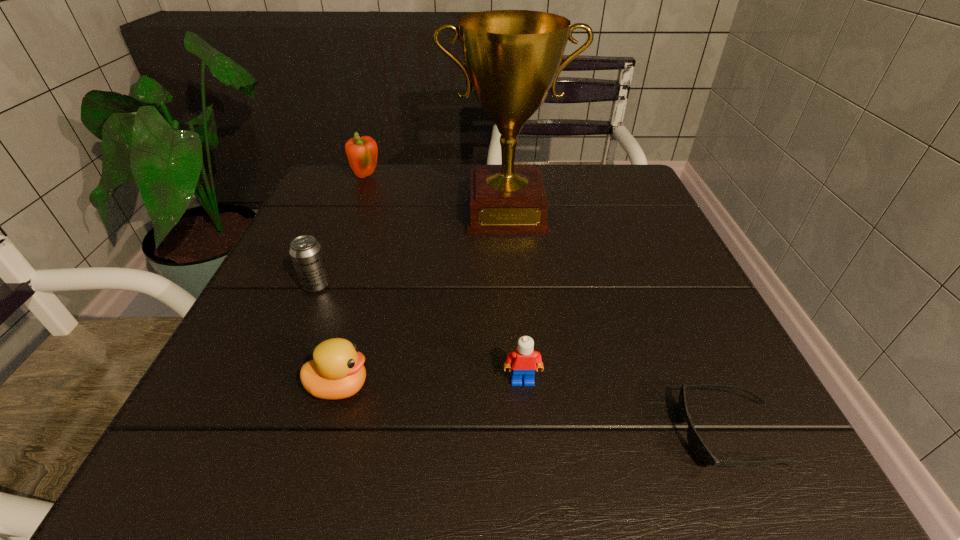
You are a GUI agent. You are given a task and a screenshot of the screen. Output one action in this format:
    pyautogui.click(x=<x>, y=<y>)
    Task: Click on the beer can at the left edge
    The width and height of the screenshot is (960, 540).
    Given the screenshot: What is the action you would take?
    pyautogui.click(x=306, y=253)

Image resolution: width=960 pixels, height=540 pixels. In order to click on duckling located at the left edge in this screenshot , I will do `click(336, 372)`.

This screenshot has width=960, height=540. In order to click on object that is at the right edge in this screenshot , I will do `click(701, 452)`.

The height and width of the screenshot is (540, 960). I want to click on object present at the far left corner, so click(x=362, y=152).

The height and width of the screenshot is (540, 960). I want to click on object that is at the near right corner, so click(x=701, y=452).

Identify the location of free space at the far edge. (564, 179).

The height and width of the screenshot is (540, 960). What are the coordinates of `free region at the near edge of the desktop` in the screenshot? It's located at (597, 455).

I want to click on free location at the left edge of the desktop, so click(x=275, y=264).

The image size is (960, 540). I want to click on vacant area at the right edge, so click(x=619, y=271).

Find the location of a particular element. The image size is (960, 540). vacant area at the far left corner is located at coordinates (380, 170).